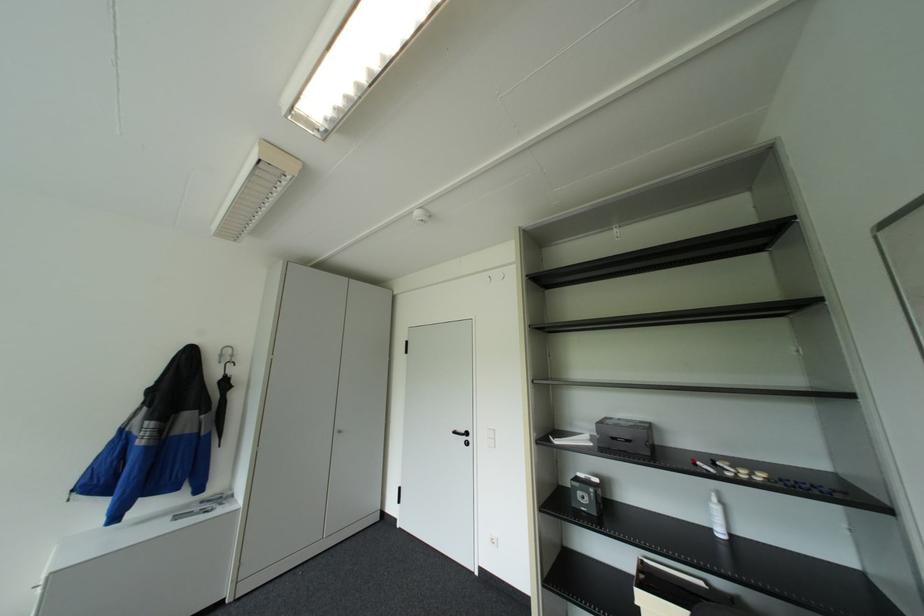
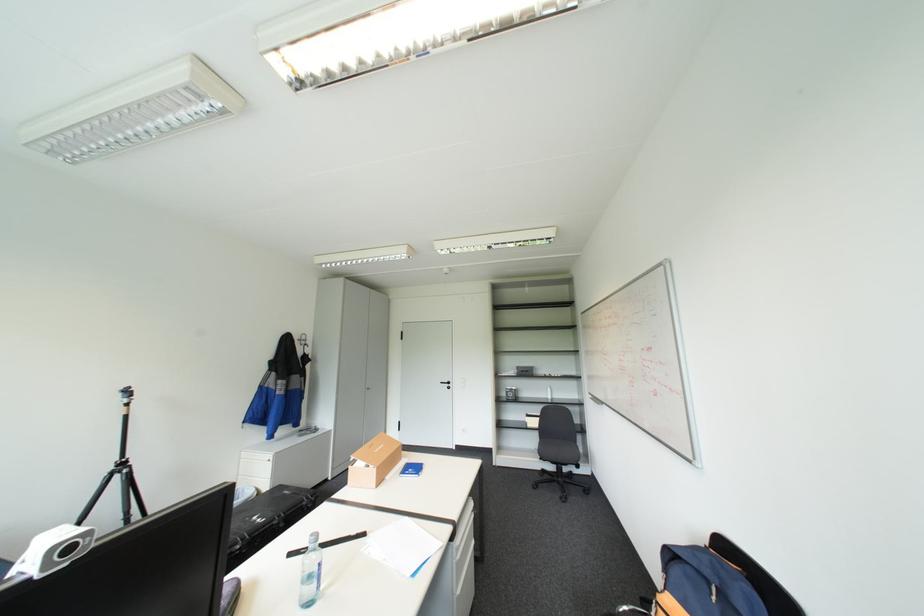
Which direction would the cameraman need to move to produce the second image?

The movement direction of the cameraman is left, backward.